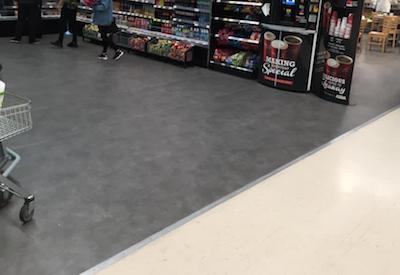
Find the location of `chair`. chair is located at coordinates (381, 34).